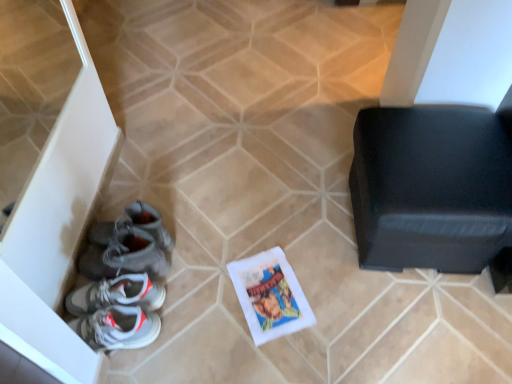
Find the location of a particular element. vacant region to the left of black leather ottoman at right is located at coordinates (290, 231).